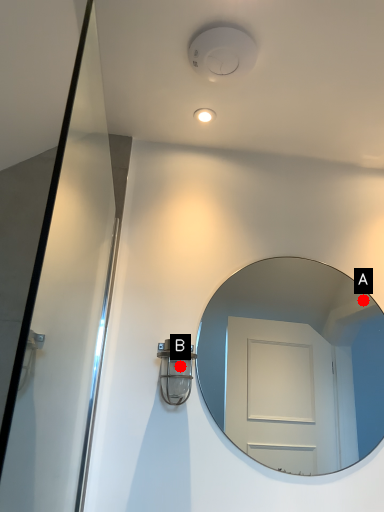
Question: Two points are circled on the image, labeled by A and B beside each circle. Which of the following is the closest to the observer?

Choices:
 (A) A is closer
 (B) B is closer

Answer: (B)